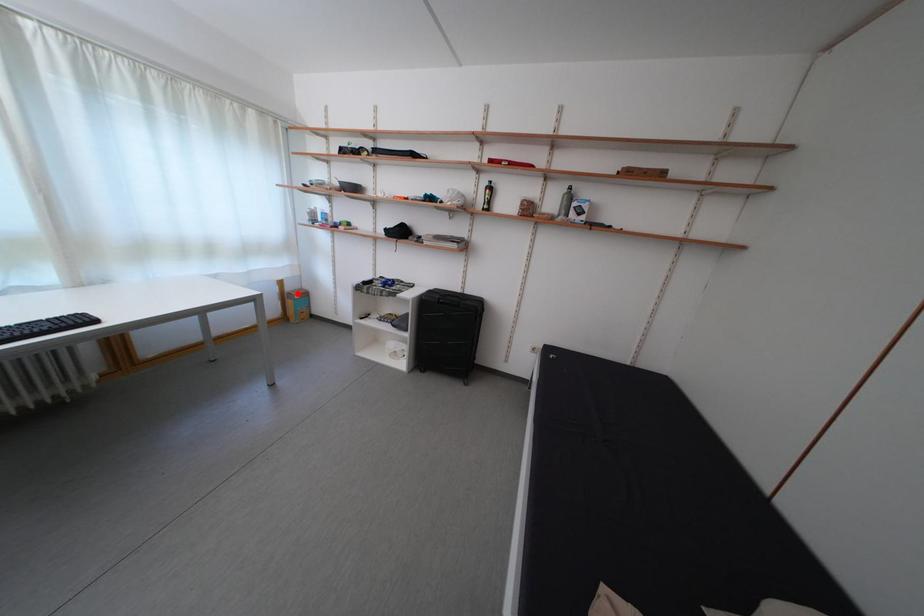
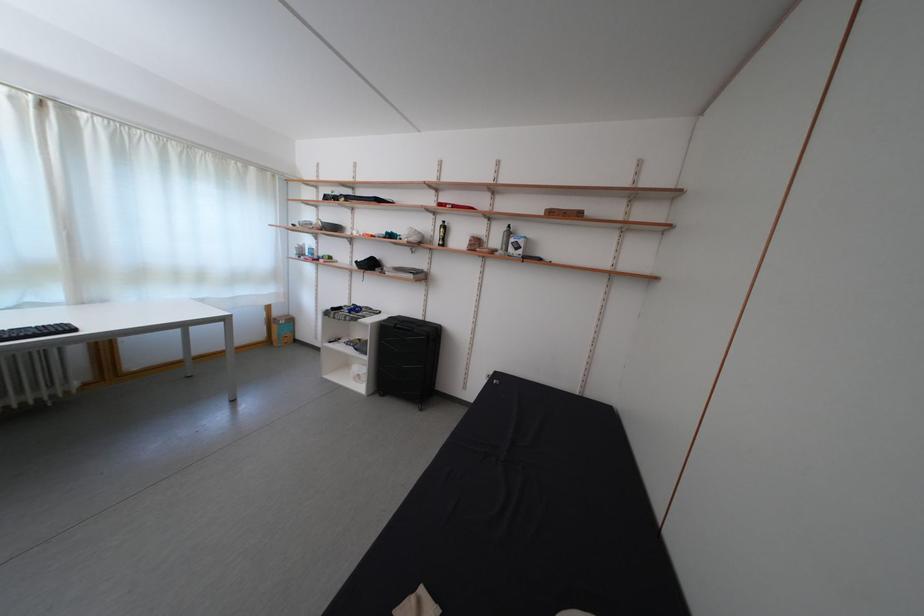
Where in the second image is the point corresponding to the highlighted location from the first image?

(285, 320)